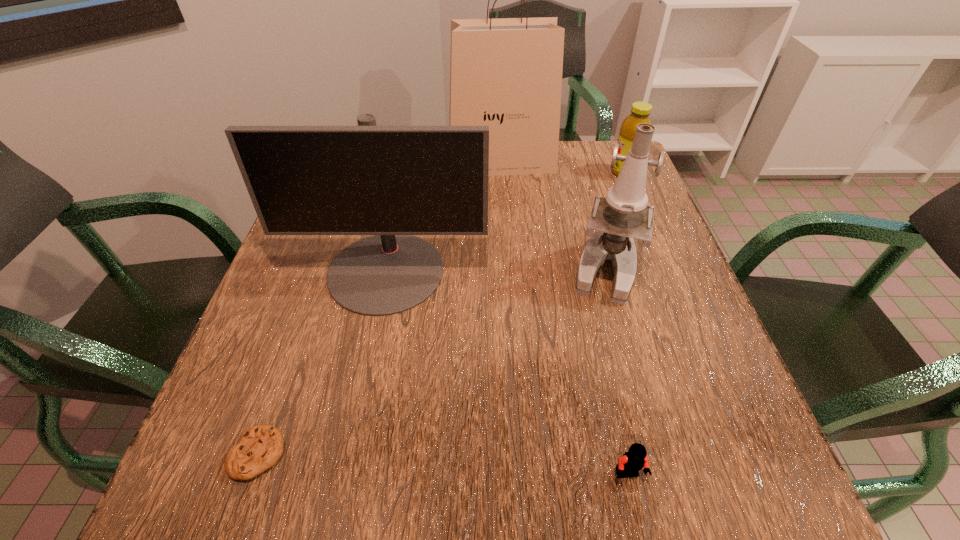
Find the location of a particular element. This screenshot has width=960, height=540. microscope located at the right edge is located at coordinates (624, 214).

Find the location of a particular element. fruit juice at the right edge is located at coordinates (640, 111).

Identify the location of object located at the near left corner. This screenshot has width=960, height=540. (261, 446).

Image resolution: width=960 pixels, height=540 pixels. Identify the location of object present at the far right corner. (640, 111).

At what (x,y) coordinates should I click in order to perform the action: click on free location at the far edge. Please return your answer as a coordinate pair (x, y). The width and height of the screenshot is (960, 540). Looking at the image, I should click on (537, 183).

At what (x,y) coordinates should I click in order to perform the action: click on vacant space at the near edge. Please return your answer as a coordinate pair (x, y). This screenshot has width=960, height=540. Looking at the image, I should click on (365, 507).

The width and height of the screenshot is (960, 540). Find the location of `free space at the left edge of the desktop`. free space at the left edge of the desktop is located at coordinates (292, 252).

Image resolution: width=960 pixels, height=540 pixels. In the image, there is a desktop. What are the coordinates of `vacant space at the right edge` in the screenshot? It's located at (690, 366).

The image size is (960, 540). I want to click on vacant space at the far right corner of the desktop, so coord(602,147).

At what (x,y) coordinates should I click in order to perform the action: click on free space between the rightmost object and the cookie. Please return your answer as a coordinate pair (x, y). The image size is (960, 540). Looking at the image, I should click on (442, 313).